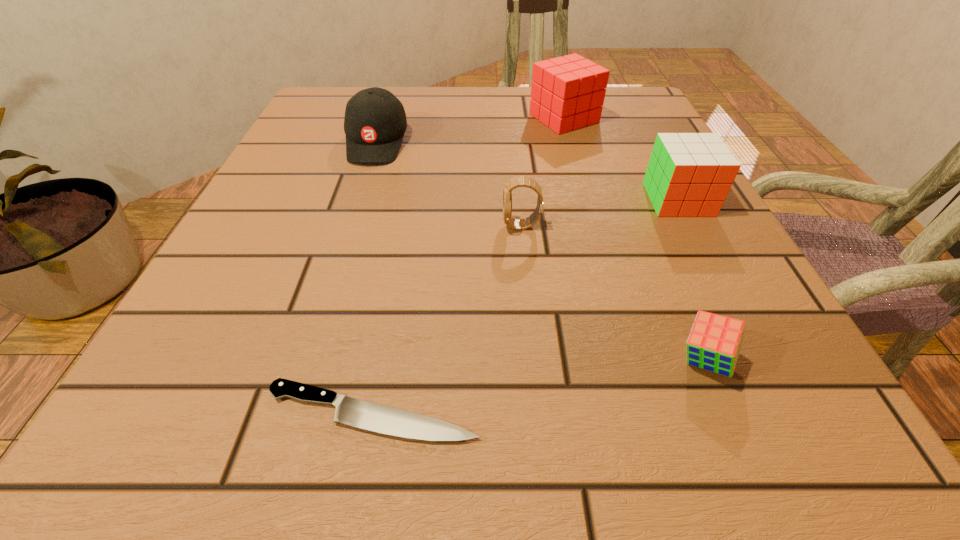
Where is `object at the far left corner`? This screenshot has height=540, width=960. object at the far left corner is located at coordinates (375, 122).

Find the location of `object present at the near left corner`. object present at the near left corner is located at coordinates (349, 411).

Locate an element on the screen. Image resolution: width=960 pixels, height=540 pixels. object positioned at the far right corner is located at coordinates (567, 93).

This screenshot has width=960, height=540. What are the coordinates of `free region at the far edge of the desktop` in the screenshot? It's located at (520, 134).

Image resolution: width=960 pixels, height=540 pixels. In the image, there is a desktop. Find the location of `vacant space at the near edge`. vacant space at the near edge is located at coordinates (649, 464).

Find the location of a particular element. The image size is (960, 540). vacant space at the left edge is located at coordinates (218, 330).

Image resolution: width=960 pixels, height=540 pixels. I want to click on free space at the right edge of the desktop, so click(x=698, y=269).

Locate an element on the screen. Image resolution: width=960 pixels, height=540 pixels. vacant space at the far left corner of the desktop is located at coordinates (314, 100).

In order to click on free space between the watch and the shortest object in this screenshot , I will do `click(447, 319)`.

Where is `vacant space in between the watch and the baseball cap`? vacant space in between the watch and the baseball cap is located at coordinates (449, 184).